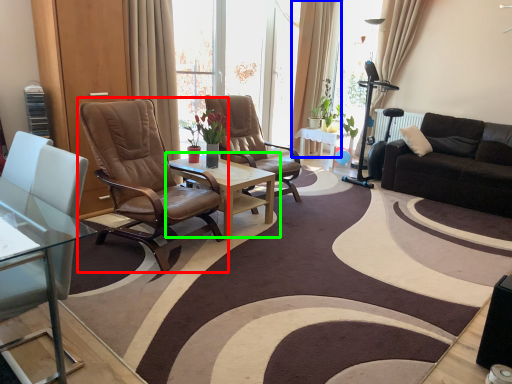
Question: Based on their relative distances, which object is nearer to chair (highlighted by a red box)? Choose from curtain (highlighted by a blue box) and coffee table (highlighted by a green box).

Choices:
 (A) curtain
 (B) coffee table

Answer: (B)